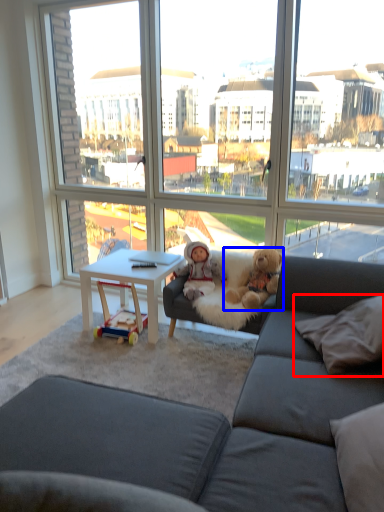
Question: Which object is further to the camera taking this photo, pillow (highlighted by a red box) or teddy bear (highlighted by a blue box)?

Choices:
 (A) pillow
 (B) teddy bear

Answer: (B)